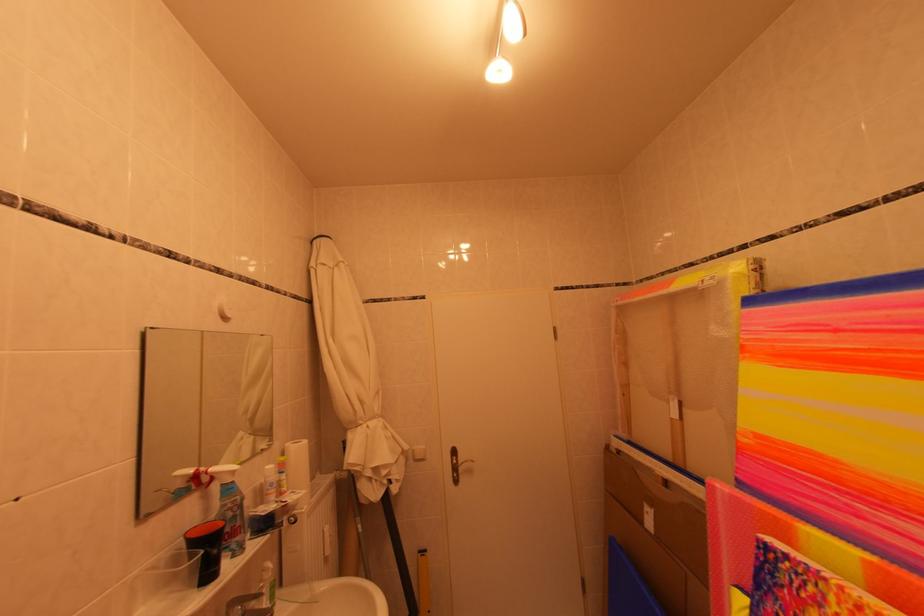
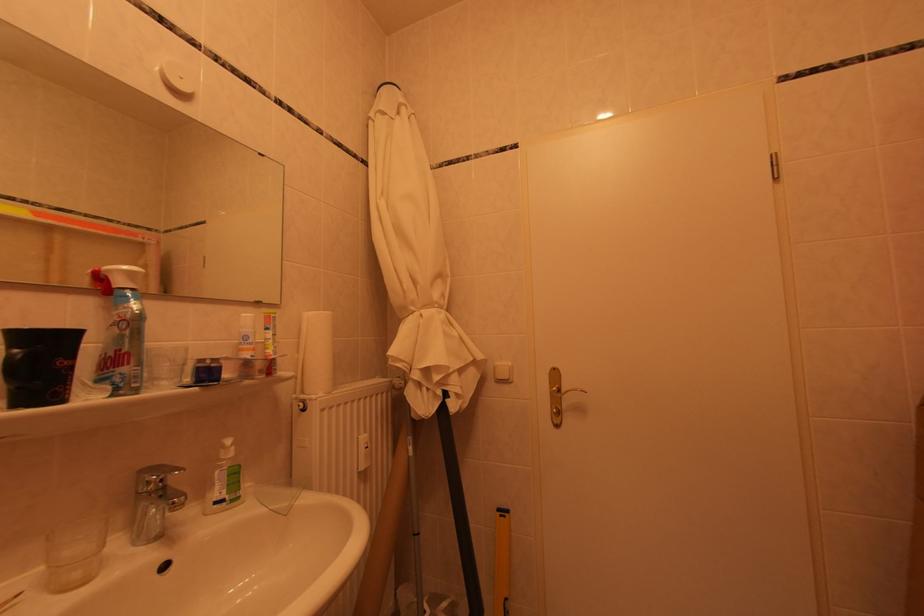
Where in the second image is the point corresponding to (430,560) from the first image?

(509, 519)